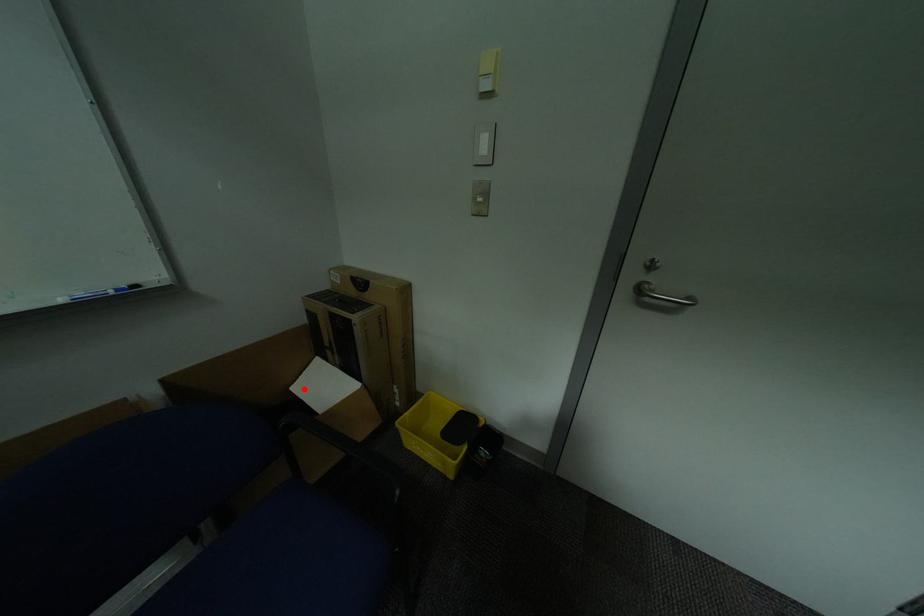
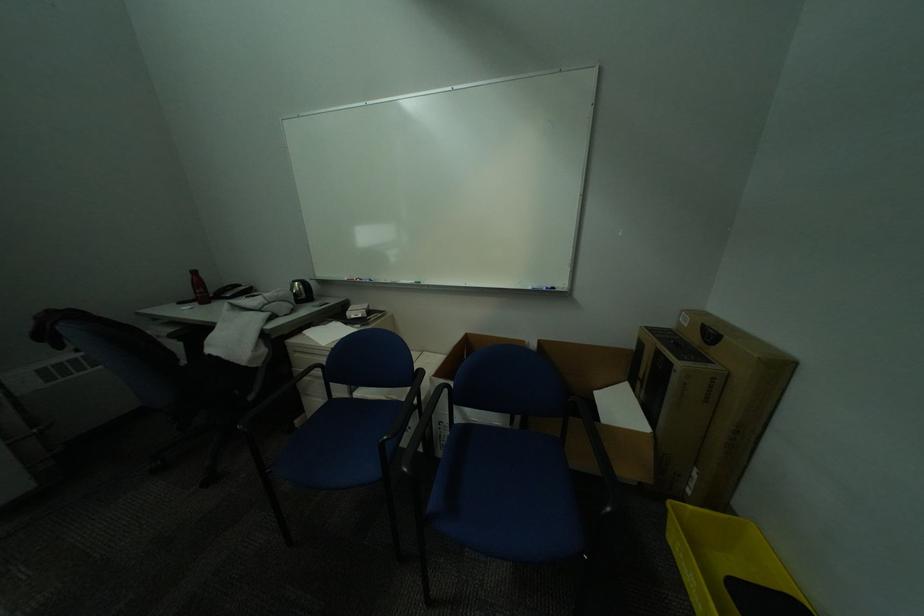
Question: A red point is marked in image1. In image2, is the corresponding 3D point closer to the camera or farther? Reply with the corresponding letter.

Choices:
 (A) The corresponding 3D point is closer.
 (B) The corresponding 3D point is farther.

Answer: (A)